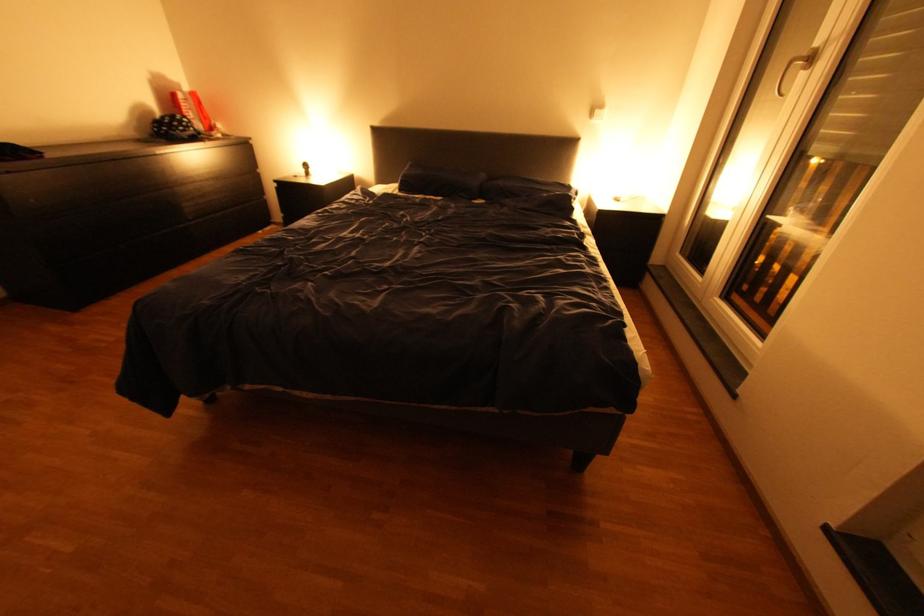
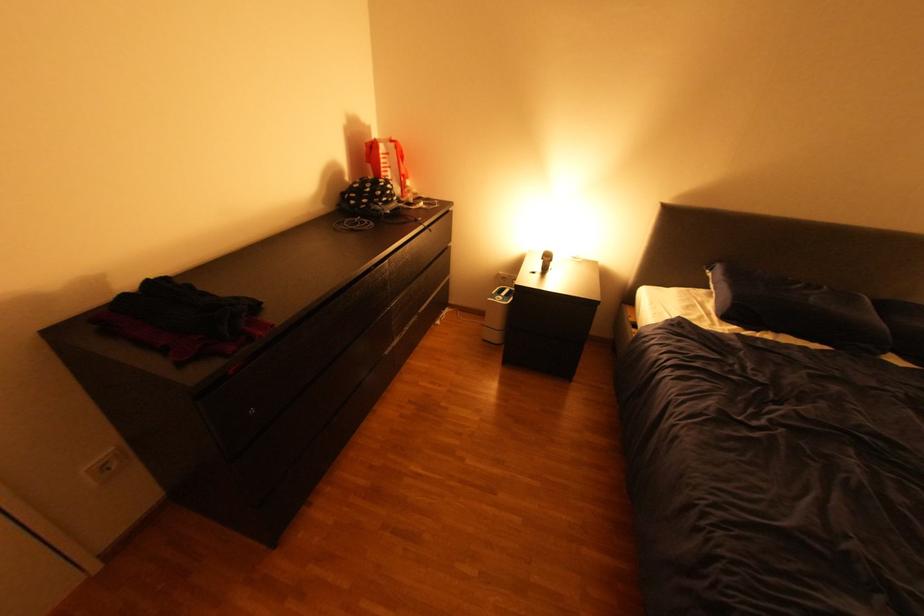
Find the pixel in the second image that matches pixel 188 84 in the first image.

(379, 129)